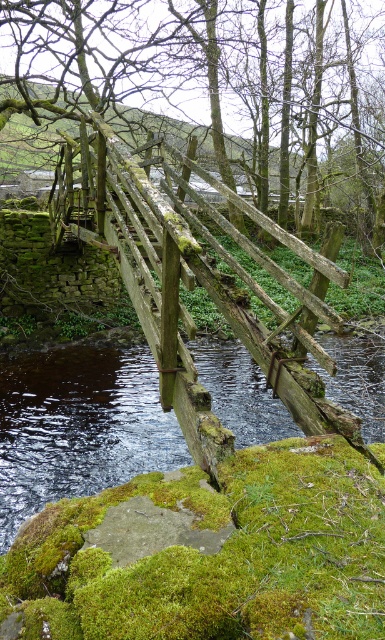
You are a hiker standing on the old wooden footbridge and want to cross to the other side. You notice the green mossy tree at center and the black water at center. Which object is higher from the ground level?

The green mossy tree at center is taller than the black water at center, so the green mossy tree at center is higher from the ground level.

You are a hiker carrying a 10 meter long rope. You want to tie the rope between the green mossy tree at center and the rusty wood rail at center to cross the river. Is the rope long enough?

The distance between the green mossy tree at center and the rusty wood rail at center is 12.85 meters. Since the rope is only 10 meters long, it is not long enough to span the gap between them.

You are standing on the old wooden footbridge and want to cross to the other side. You notice the black water at center and the rusty wood rail at center. Which object is located to the right of the other?

The black water at center is positioned on the right side of the rusty wood rail at center, so the black water at center is to the right of the rusty wood rail at center.